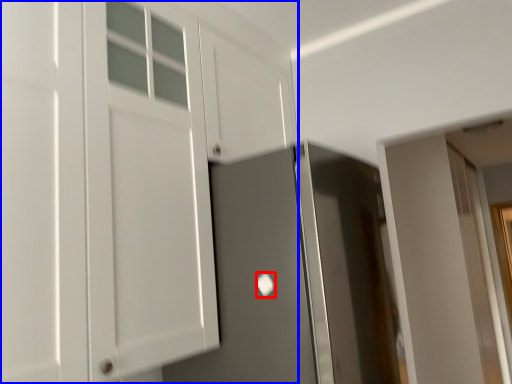
Question: Among these objects, which one is nearest to the camera, door handle (highlighted by a red box) or cabinetry (highlighted by a blue box)?

Choices:
 (A) door handle
 (B) cabinetry

Answer: (B)